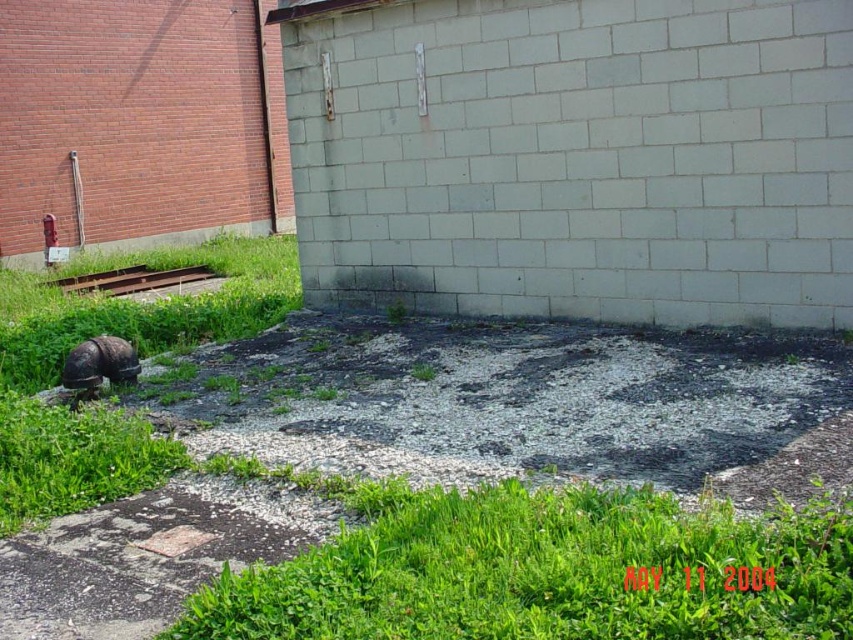
Question: In this image, where is green leafy grass at lower center located relative to smooth concrete patch at lower left?

Choices:
 (A) left
 (B) right

Answer: (B)

Question: Which object appears closest to the camera in this image?

Choices:
 (A) green leafy grass at lower center
 (B) smooth concrete patch at lower left

Answer: (A)

Question: Which point is closer to the camera?

Choices:
 (A) (193, 534)
 (B) (548, 589)

Answer: (B)

Question: Is green leafy grass at lower center positioned at the back of smooth concrete patch at lower left?

Choices:
 (A) no
 (B) yes

Answer: (A)

Question: Can you confirm if green leafy grass at lower center is positioned to the right of smooth concrete patch at lower left?

Choices:
 (A) no
 (B) yes

Answer: (B)